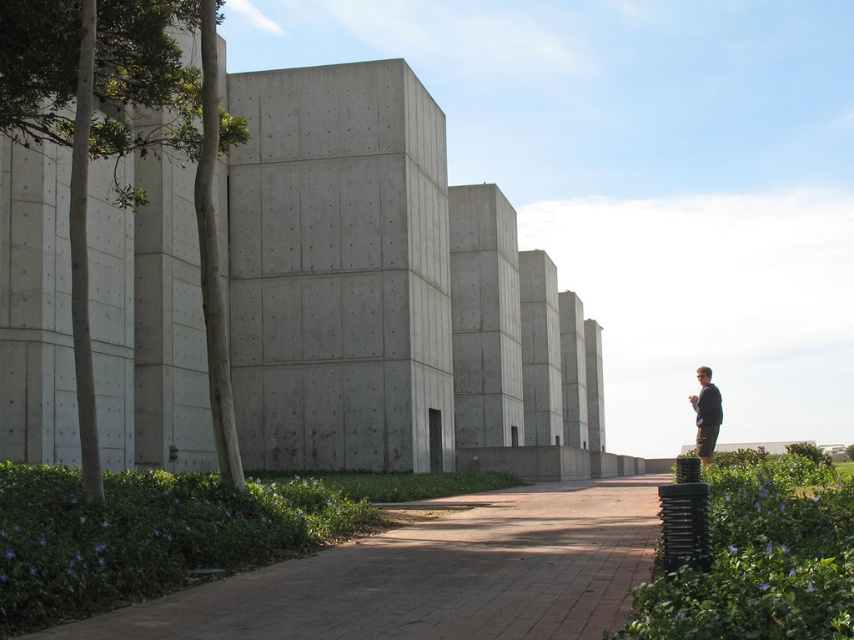
You are standing at the camera position and want to walk to the brown brick path at center. How many steps would you need to take if each step covers approximately 3 feet?

The distance between the camera and the brown brick path at center is 18.84 feet. Dividing this by the step length of 3 feet gives approximately 6.28 steps. Since you can only take whole steps, you would need to take 7 steps to reach the brown brick path at center.

You are standing at the entrance of the modern architectural structure and want to walk towards the point that is closer to you. Which point should you head towards, point (202, 596) or point (711, 401)?

You should head towards point (202, 596) because it is closer to the viewer than point (711, 401).

You are standing at the entrance of the modern building and see the brown brick path at center and the dark blue sweater at right. Which object is nearer to you?

The brown brick path at center is closer to the viewer than the dark blue sweater at right.